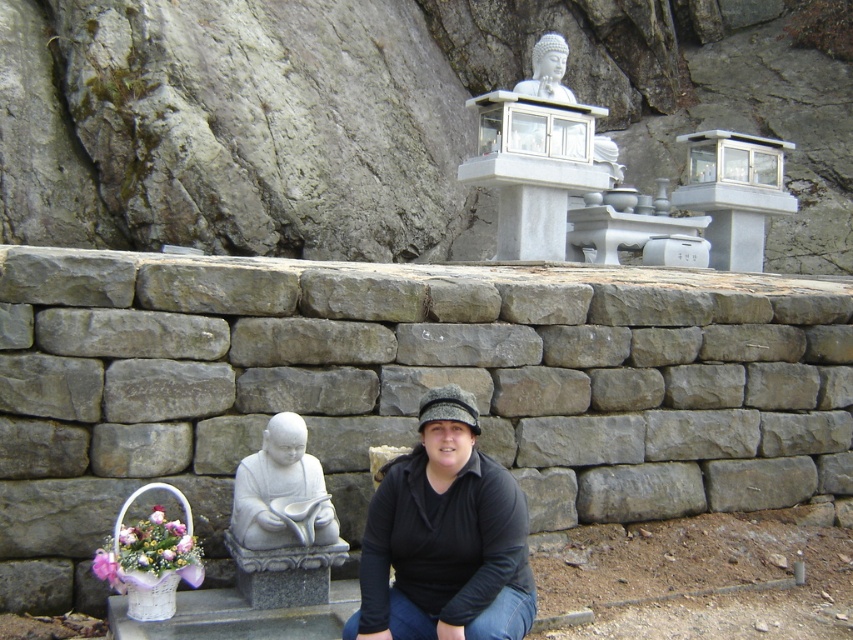
You are a photographer trying to capture the black fabric squat at center and the white stone statue at upper center in the same frame. Given their sizes, which object would appear bigger in the photo?

The black fabric squat at center appears bigger in the photo because it has a larger size compared to the white stone statue at upper center.